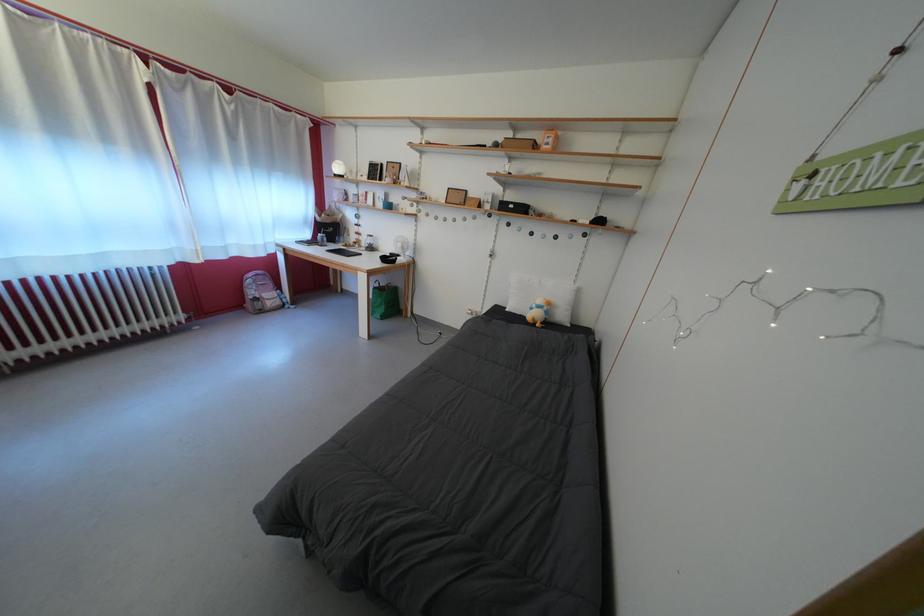
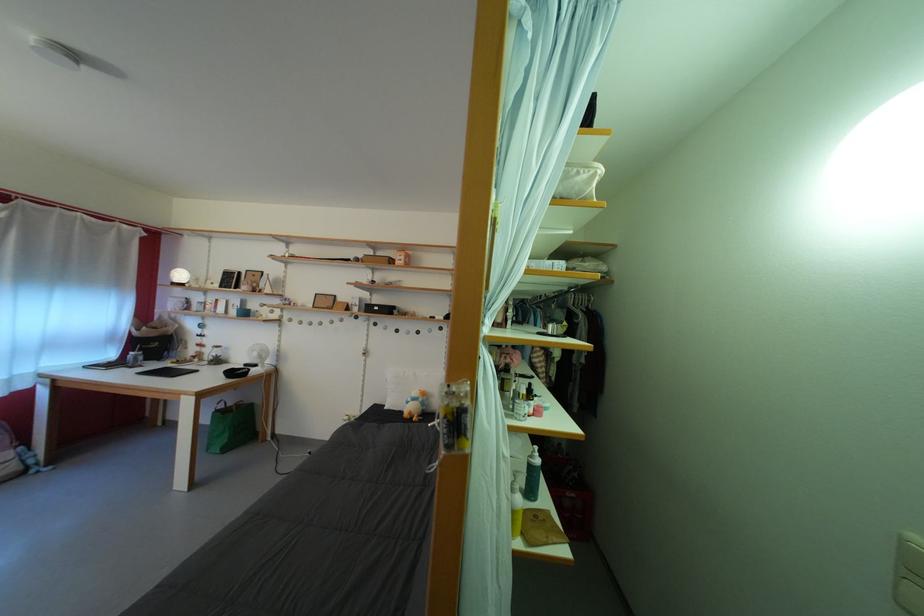
Based on the photo, the first image is from the beginning of the video and the second image is from the end. How did the camera likely rotate when shooting the video?

The camera's rotation is toward right-up.